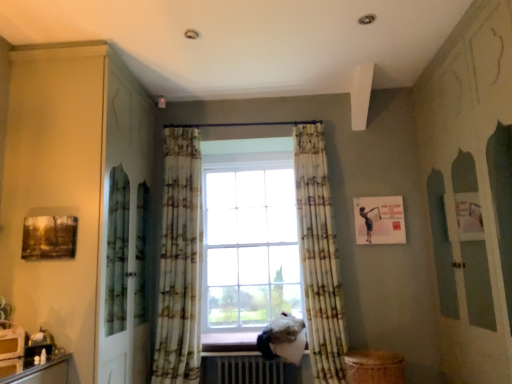
Question: Is wooden at lower center wider or thinner than metallic silver radiator at lower center?

Choices:
 (A) wide
 (B) thin

Answer: (B)

Question: Is point (234, 344) closer or farther from the camera than point (279, 375)?

Choices:
 (A) closer
 (B) farther

Answer: (B)

Question: Which object is the farthest from the wooden at lower center?

Choices:
 (A) metallic silver radiator at lower center
 (B) floral fabric curtain at center, the first curtain when ordered from left to right
 (C) floral fabric curtain at center, arranged as the second curtain when viewed from the left

Answer: (C)

Question: Considering the real-world distances, which object is closest to the metallic silver radiator at lower center?

Choices:
 (A) floral fabric curtain at center, the first curtain when ordered from left to right
 (B) floral fabric curtain at center, arranged as the second curtain when viewed from the left
 (C) wooden at lower center

Answer: (C)